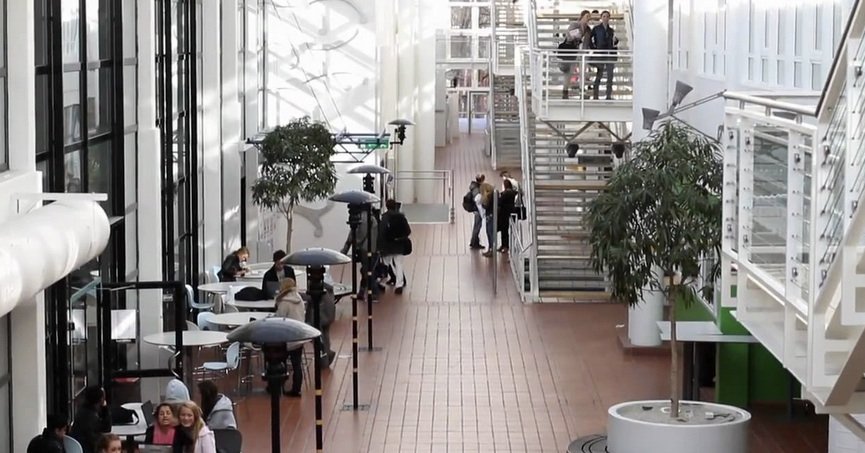
The image size is (865, 453). I want to click on wall, so click(725, 26), click(356, 52).